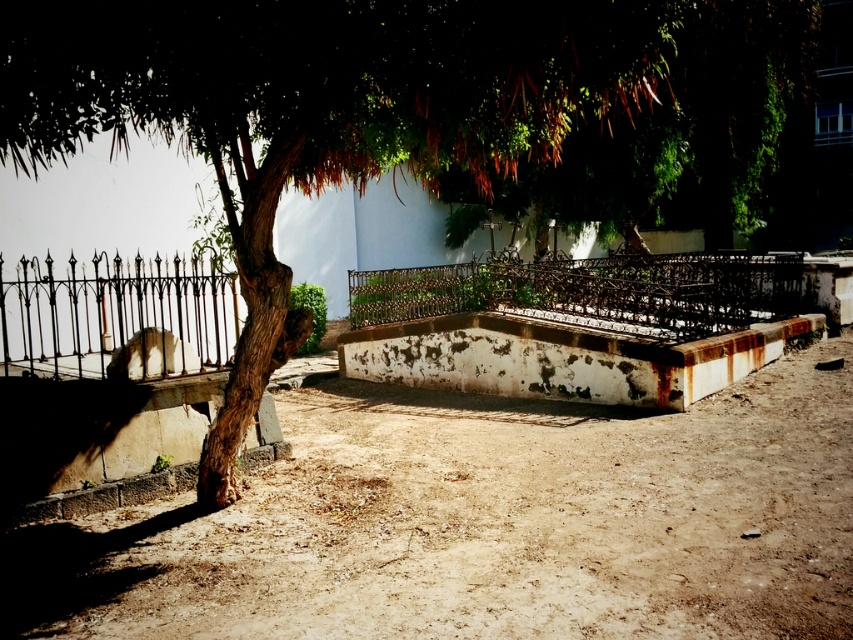
You are standing in the outdoor scene and want to walk to the rusty metal fence at center. Which direction should you move relative to the brown dusty ground at center?

Since the brown dusty ground at center is in front of the rusty metal fence at center, you should move backward away from the brown dusty ground at center to reach the rusty metal fence at center.